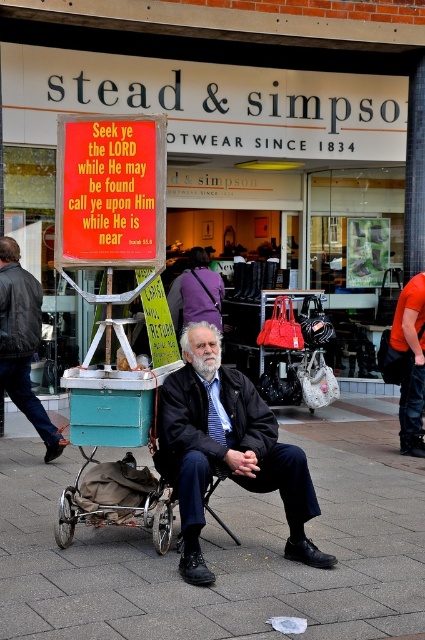
What is the relationship between the height of the matte black sign at center and the paved stone pavement at center in the scene?

The matte black sign at center is taller than the paved stone pavement at center.

You are a customer entering the store and notice two items near the entrance. The dark blue fabric jacket at center and the metallic signboard at left. Which item is wider?

The dark blue fabric jacket at center is wider than the metallic signboard at left.